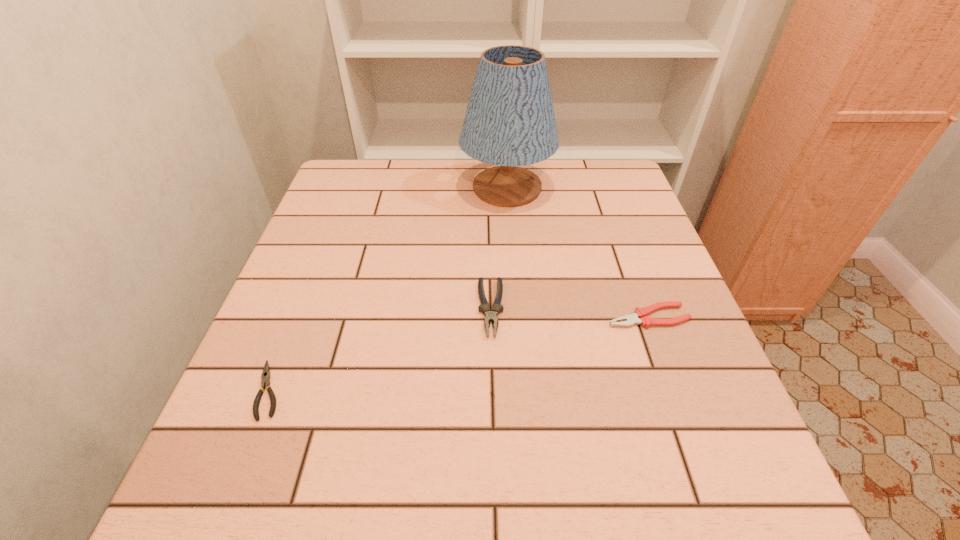
This screenshot has height=540, width=960. Identify the location of vacant area that lies between the leftmost pliers and the rightmost object. (459, 353).

Locate an element on the screen. This screenshot has width=960, height=540. vacant area that lies between the second tallest object and the second shortest pliers is located at coordinates (569, 313).

Locate an element on the screen. unoccupied area between the shortest pliers and the tallest object is located at coordinates (388, 289).

The width and height of the screenshot is (960, 540). I want to click on object that is the second closest one to the farthest object, so click(x=639, y=316).

Point out which object is positioned as the nearest to the tallest object. Please provide its 2D coordinates. Your answer should be formatted as a tuple, i.e. [(x, y)], where the tuple contains the x and y coordinates of a point satisfying the conditions above.

[(484, 308)]

You are a GUI agent. You are given a task and a screenshot of the screen. Output one action in this format:
    pyautogui.click(x=<x>, y=<y>)
    Task: Click on the pliers that is the second closest to the rightmost pliers
    
    Given the screenshot: What is the action you would take?
    pyautogui.click(x=266, y=375)

Locate which pliers is the closest to the leftmost pliers. Please provide its 2D coordinates. Your answer should be formatted as a tuple, i.e. [(x, y)], where the tuple contains the x and y coordinates of a point satisfying the conditions above.

[(484, 308)]

This screenshot has height=540, width=960. What are the coordinates of `vacant space that satisfies the following two spatial constraints: 1. at the gripping part of the second pliers from right to left; 2. on the left side of the rightmost pliers` in the screenshot? It's located at (491, 316).

Locate an element on the screen. vacant position in the image that satisfies the following two spatial constraints: 1. at the gripping part of the rightmost pliers; 2. on the left side of the second pliers from left to right is located at coordinates (491, 316).

Identify the location of free space that satisfies the following two spatial constraints: 1. on the back side of the nearest object; 2. on the left side of the farthest object. (348, 188).